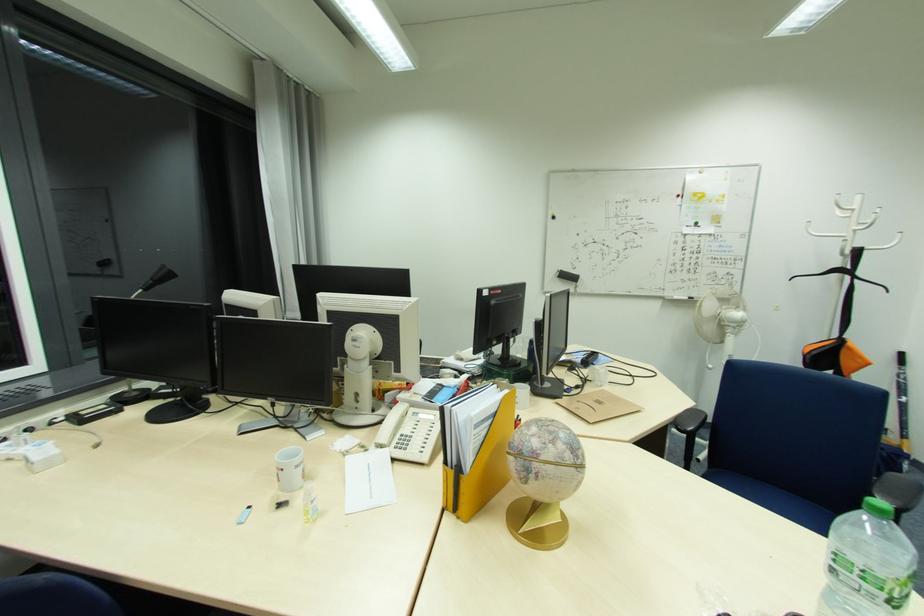
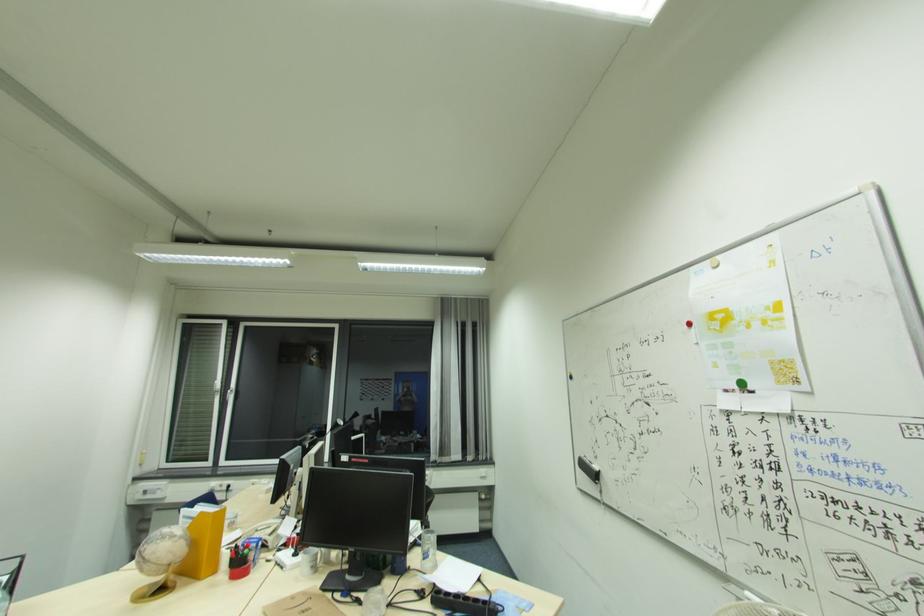
The point at (697, 225) is marked in the first image. Where is the corresponding point in the second image?

(739, 387)